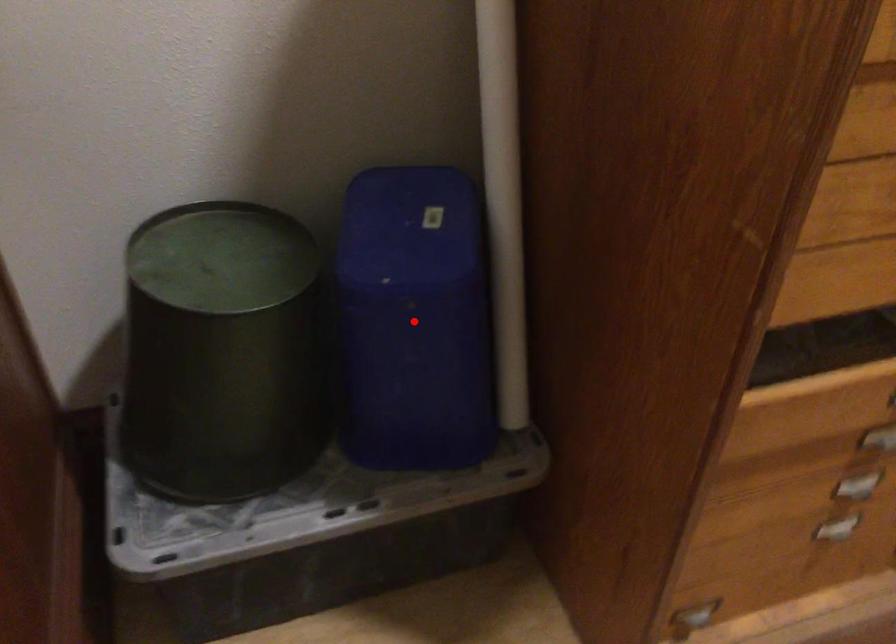
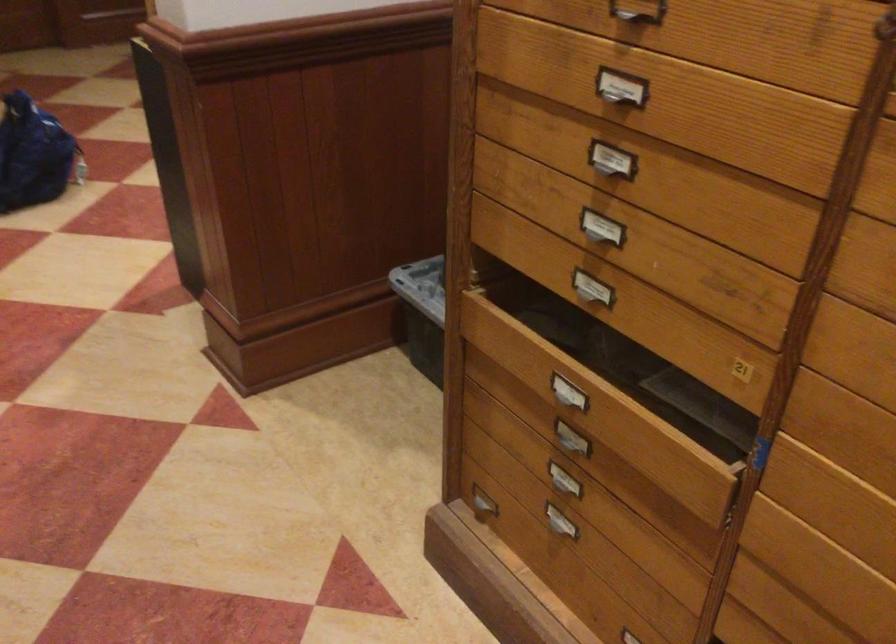
Question: I am providing you with two images of the same scene from different viewpoints. A red point is marked on the first image. At the location where the point appears in image 1, is it still visible in image 2?

Choices:
 (A) Yes
 (B) No

Answer: (B)